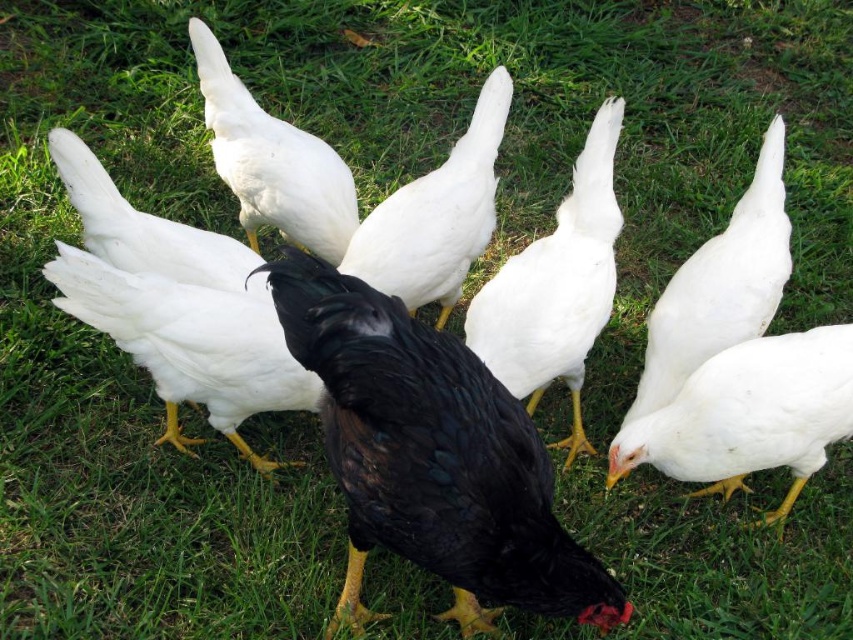
In the scene shown: You are a farmer who wants to separate two chickens for feeding. The chickens are the black glossy chicken at center and the black matte chicken at center. How far apart are they from each other?

The black glossy chicken at center is 19.50 inches from the black matte chicken at center, so they are 19.50 inches apart.